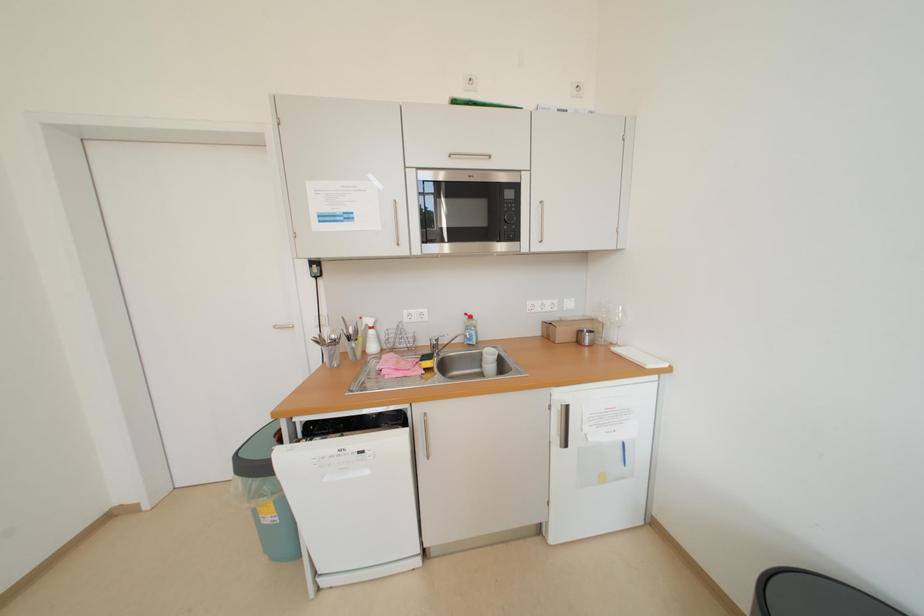
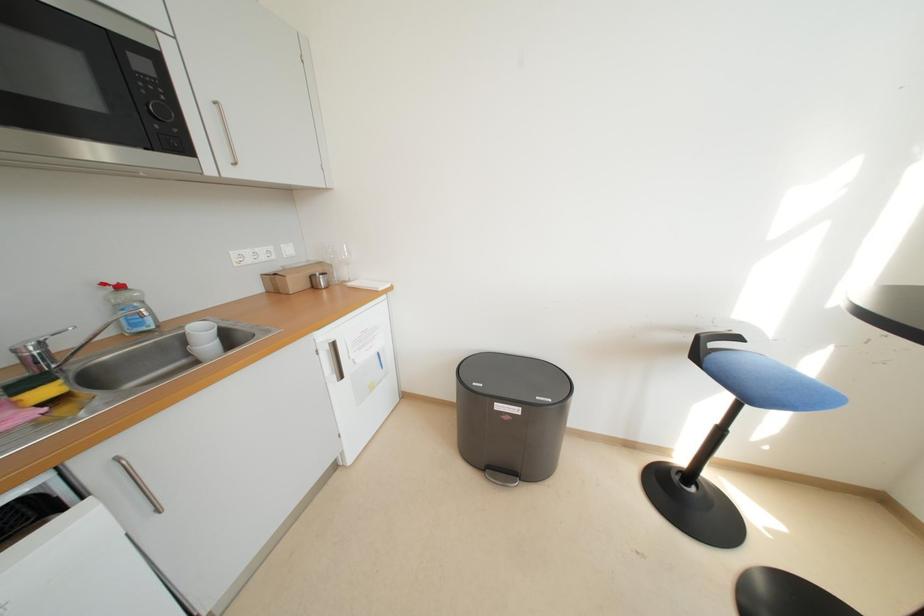
Based on the continuous images, in which direction is the camera rotating?

The rotation direction of the camera is right-down.